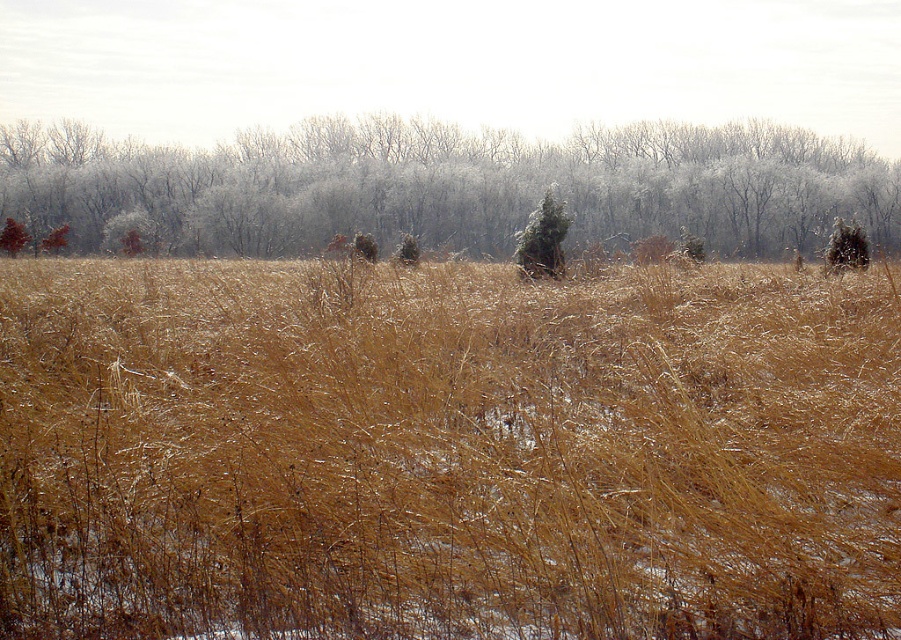
Looking at this image, you are standing at the edge of the field and want to walk directly to the green textured pine at center. However, there is brown dry grass at center in your path. Can you walk around it without deviating from your intended path?

The brown dry grass at center is 6.23 meters away from the green textured pine at center. Since the distance between them is significant, you can easily walk around the brown dry grass at center while still heading towards the green textured pine at center without deviating much from your path.